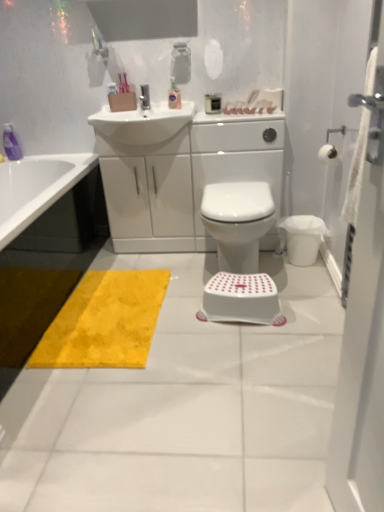
At what (x,y) coordinates should I click in order to perform the action: click on free location in front of white plastic step stool at center. Please return your answer as a coordinate pair (x, y). The width and height of the screenshot is (384, 512). Looking at the image, I should click on (256, 350).